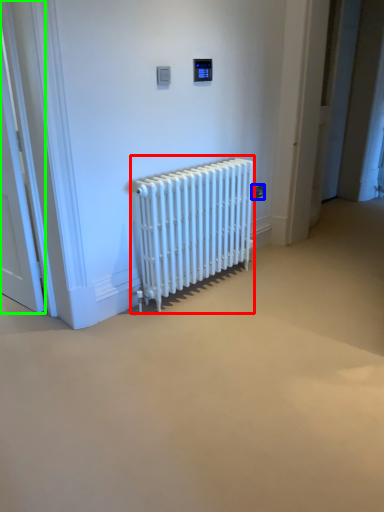
Question: Which object is the farthest from radiator (highlighted by a red box)? Choose among these: electric outlet (highlighted by a blue box) or door (highlighted by a green box).

Choices:
 (A) electric outlet
 (B) door

Answer: (B)